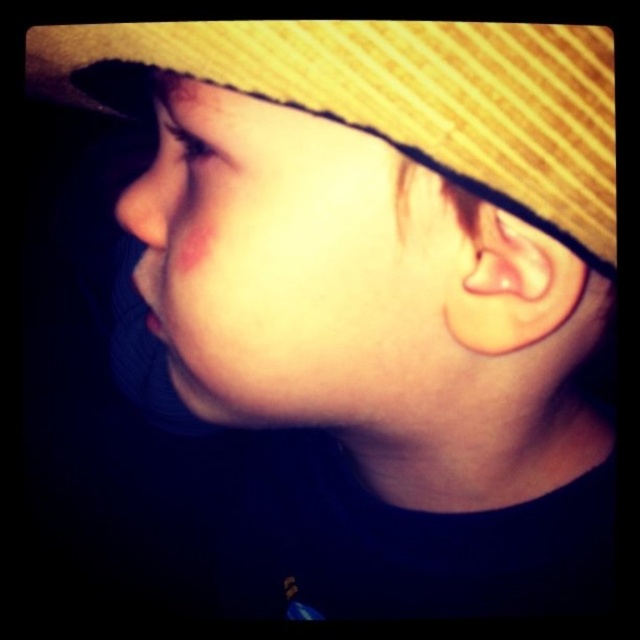
Consider the image. You are a photographer adjusting the lighting for a close portrait. The subject has a straw hat casting a shadow on their forehead. You need to ensure that the pink skin at center, marked by point (292, 266), is well lit. Where should you position the light relative to the subject to avoid the shadow from the hat?

To avoid the shadow from the straw hat and properly illuminate the pink skin at center marked by point (292, 266), position the light source above the subject so that it shines downward, counteracting the shadow cast by the hat.

You are a photographer adjusting lighting for a portrait. You need to ensure the yellow woven hat at upper center and the matte skin nose at left are both visible. Since the background is dark, which object should you focus the light on to highlight both effectively?

The yellow woven hat at upper center is bigger than the matte skin nose at left, so focusing the light on the yellow woven hat at upper center will help highlight both objects effectively due to its larger size.

You are an artist sketching the face in the image. You want to place a highlight on the pink skin at center. According to the image, where should you place it in terms of coordinates?

The pink skin at center is located at coordinates point (292, 266), so you should place the highlight there.